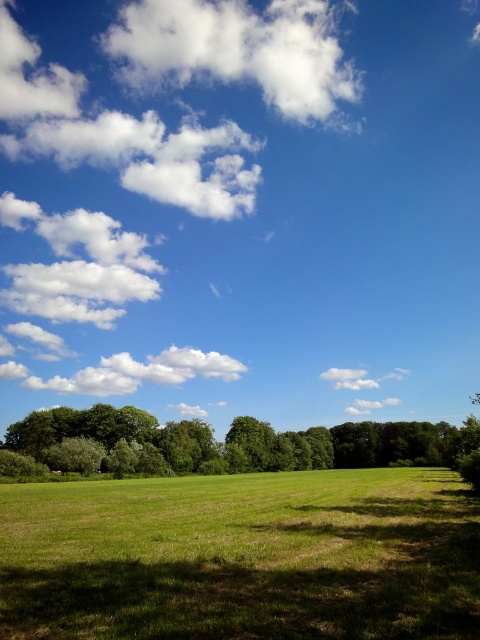
Question: Among these objects, which one is nearest to the camera?

Choices:
 (A) white fluffy cloud at upper left
 (B) blue sky at upper center
 (C) white fluffy cloud at upper center

Answer: (B)

Question: Which of the following is the closest to the observer?

Choices:
 (A) (330, 577)
 (B) (28, 129)
 (C) (463, 442)

Answer: (A)

Question: Is blue sky at upper center wider than green leafy tree at lower left?

Choices:
 (A) yes
 (B) no

Answer: (A)

Question: Which point is farther to the camera?

Choices:
 (A) (410, 637)
 (B) (27, 42)
 (C) (243, 45)
 (D) (149, 440)

Answer: (B)

Question: Is the position of blue sky at upper center more distant than that of green grassy field at center?

Choices:
 (A) no
 (B) yes

Answer: (B)

Question: Can you confirm if green grassy field at center is positioned to the left of green leafy tree at lower left?

Choices:
 (A) no
 (B) yes

Answer: (B)